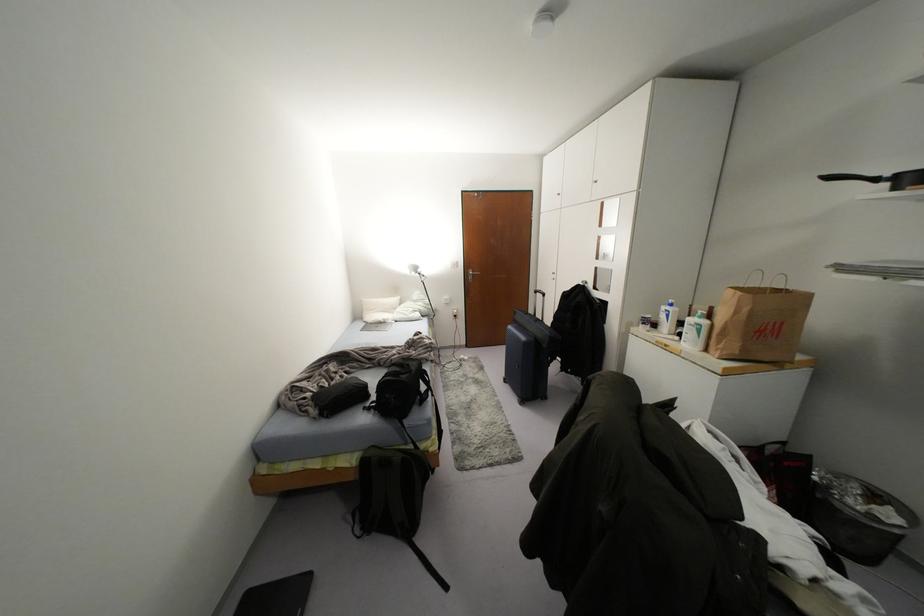
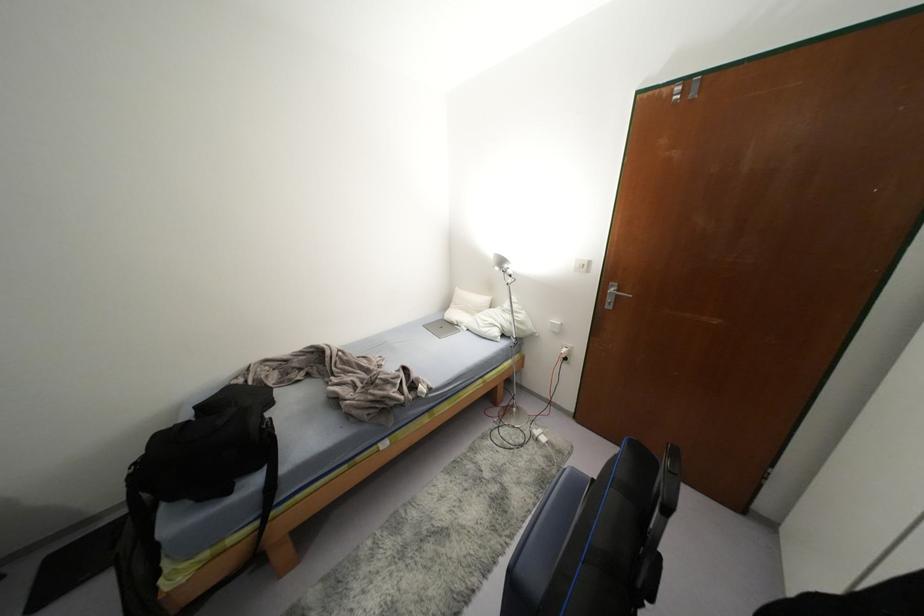
Find the pixel in the second image that matches point 419,270 in the first image.

(505, 265)